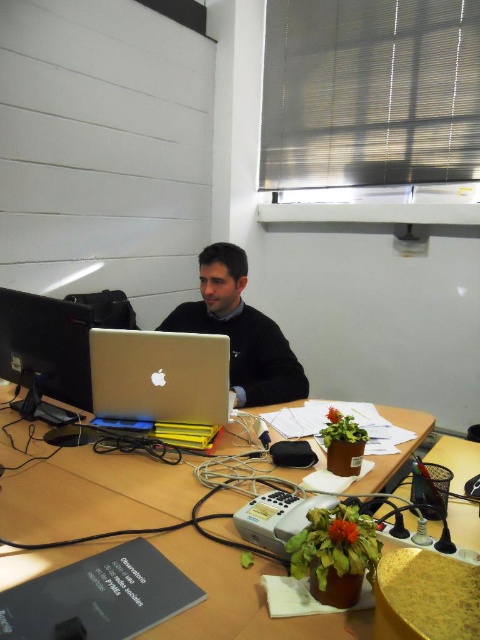
You are organizing the desk and want to place a new wireless charger between the silver metallic laptop at center and the matte black monitor at left. Based on their current positions, where should you place the charger so that it is equidistant from both devices?

The silver metallic laptop at center is positioned under the matte black monitor at left, so placing the wireless charger directly between them would require positioning it in the space between the two devices, ensuring equal distance from both the silver metallic laptop at center and the matte black monitor at left.

You are organizing cables on a desk and need to route a cable from the power strip to the monitor. The power strip is at point (80,333) and the monitor is at point (255,364). Given that cables can only be routed along the desk surface, which direction should you move from the power strip to reach the monitor?

To route the cable from the power strip at point (80,333) to the monitor at point (255,364), you should move upwards and to the right. This is because point (255,364) is behind point (80,333), indicating it is both higher and to the right on the desk surface.